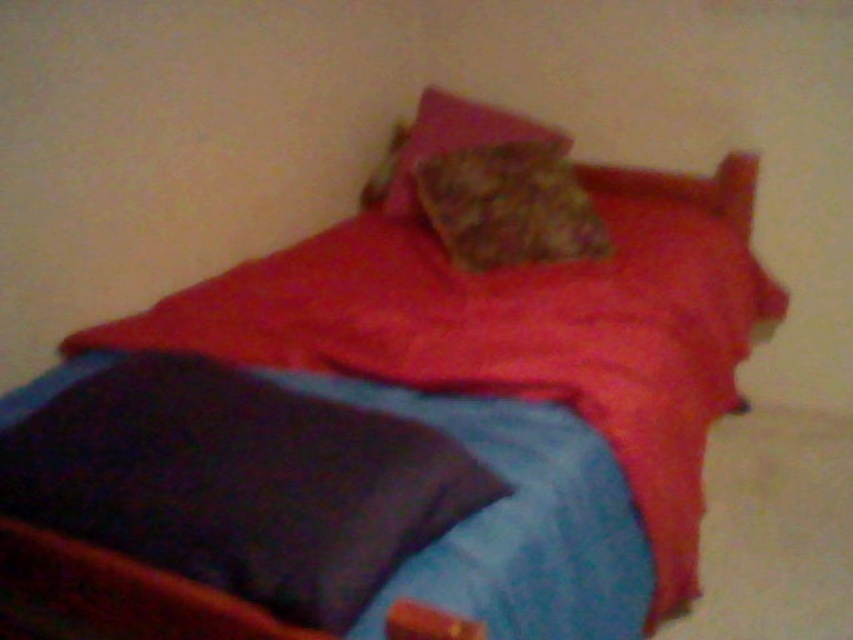
You are trying to place a small book on the bed. The fluffy brown pillow at center and the fluffy pink pillow at upper center are in the way. Which pillow should you move to make space?

The fluffy pink pillow at upper center is above the fluffy brown pillow at center. To make space, you should move the fluffy pink pillow at upper center since it is positioned higher up and moving it would free up the area below.

You are trying to locate the blue fabric sheet at lower left in the image. What are its coordinates?

The blue fabric sheet at lower left is located at coordinates point (x=519, y=522).